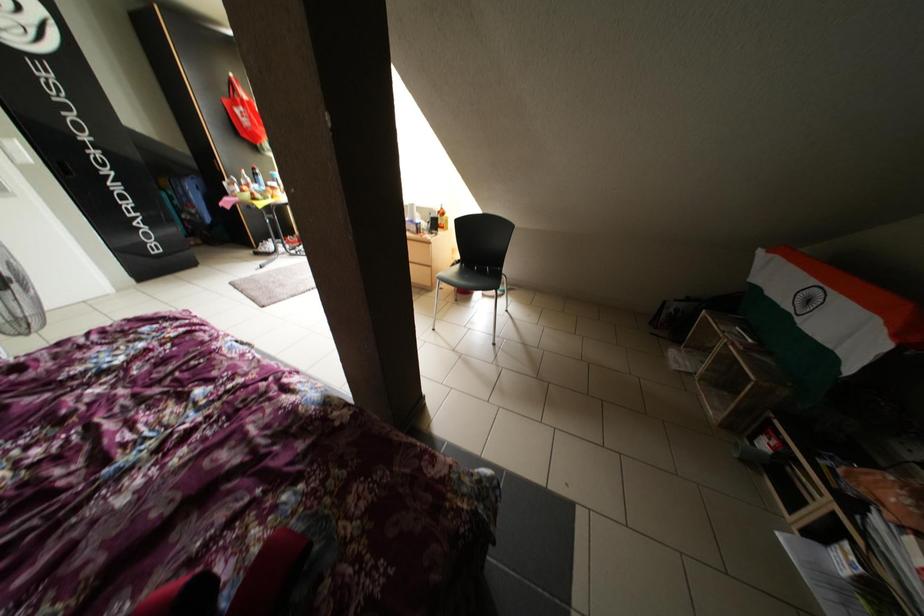
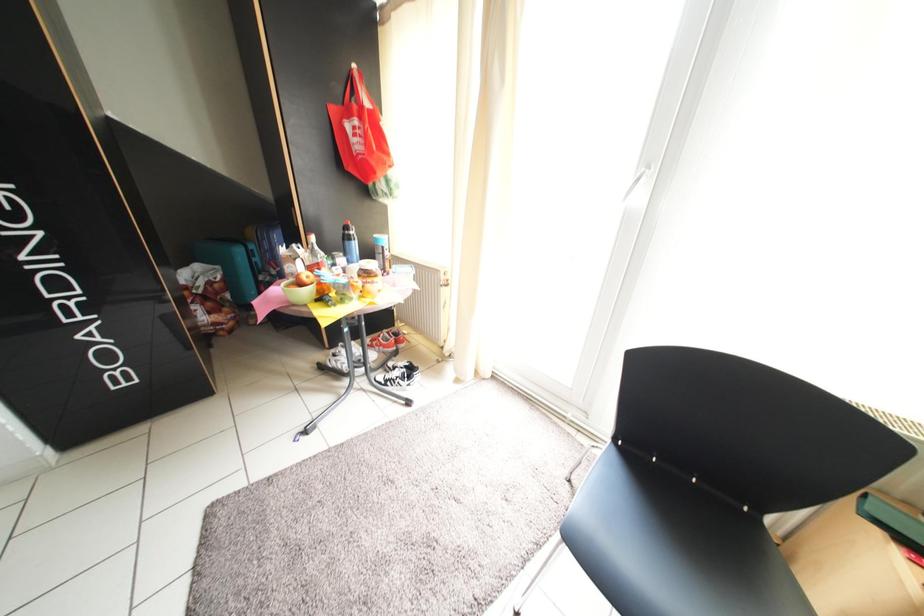
The images are taken continuously from a first-person perspective. In which direction are you moving?

The cameraman moved toward left, forward.